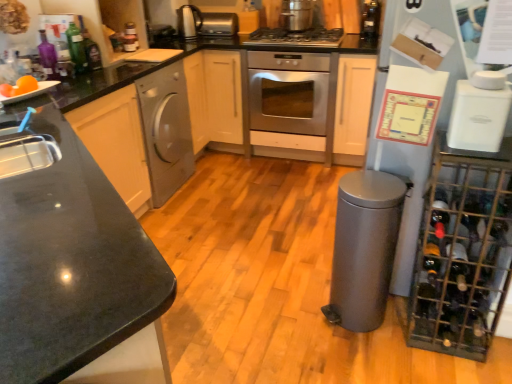
Question: Is black granite countertop at left smaller than stainless steel oven at center?

Choices:
 (A) yes
 (B) no

Answer: (B)

Question: Is there a large distance between black granite countertop at left and stainless steel oven at center?

Choices:
 (A) yes
 (B) no

Answer: (A)

Question: From a real-world perspective, is black granite countertop at left on top of stainless steel oven at center?

Choices:
 (A) no
 (B) yes

Answer: (B)

Question: Does black granite countertop at left have a greater height compared to stainless steel oven at center?

Choices:
 (A) no
 (B) yes

Answer: (B)

Question: Would you say black granite countertop at left is outside stainless steel oven at center?

Choices:
 (A) yes
 (B) no

Answer: (A)

Question: Considering the relative positions of black granite countertop at left and stainless steel oven at center in the image provided, is black granite countertop at left to the right of stainless steel oven at center from the viewer's perspective?

Choices:
 (A) no
 (B) yes

Answer: (A)

Question: Considering the relative sizes of green glass bottle at upper left, the second bottle positioned from the right, and metallic wire wine rack at right in the image provided, is green glass bottle at upper left, the second bottle positioned from the right, bigger than metallic wire wine rack at right?

Choices:
 (A) no
 (B) yes

Answer: (A)

Question: From the image's perspective, is green glass bottle at upper left, the 3th bottle when ordered from left to right, under metallic wire wine rack at right?

Choices:
 (A) no
 (B) yes

Answer: (A)

Question: Considering the relative positions of green glass bottle at upper left, the 3th bottle when ordered from left to right, and metallic wire wine rack at right in the image provided, is green glass bottle at upper left, the 3th bottle when ordered from left to right, to the right of metallic wire wine rack at right from the viewer's perspective?

Choices:
 (A) yes
 (B) no

Answer: (B)

Question: Is green glass bottle at upper left, the 3th bottle when ordered from left to right, looking in the opposite direction of metallic wire wine rack at right?

Choices:
 (A) no
 (B) yes

Answer: (A)

Question: Could metallic wire wine rack at right be considered to be inside green glass bottle at upper left, the second bottle from the bottom?

Choices:
 (A) yes
 (B) no

Answer: (B)

Question: Considering the relative sizes of green glass bottle at upper left, the 3th bottle positioned from the top, and metallic wire wine rack at right in the image provided, is green glass bottle at upper left, the 3th bottle positioned from the top, thinner than metallic wire wine rack at right?

Choices:
 (A) no
 (B) yes

Answer: (B)

Question: Does orange matte at left have a smaller size compared to translucent glass bottle at upper right, which is the fourth bottle in front-to-back order?

Choices:
 (A) no
 (B) yes

Answer: (B)